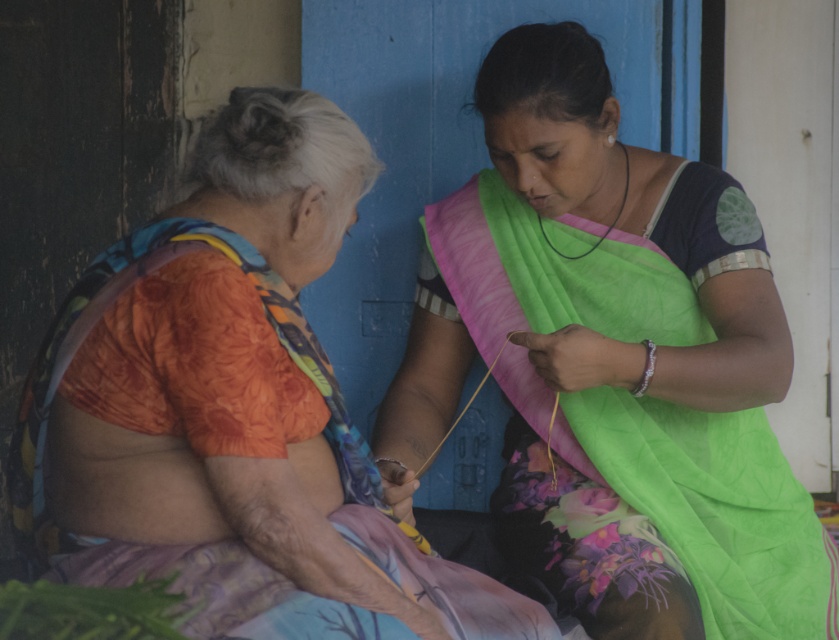
Question: Does green silk saree at center lie in front of orange floral blouse at left?

Choices:
 (A) yes
 (B) no

Answer: (B)

Question: Is green silk saree at center wider than orange floral blouse at left?

Choices:
 (A) no
 (B) yes

Answer: (B)

Question: Which of the following is the closest to the observer?

Choices:
 (A) green silk saree at center
 (B) orange floral blouse at left

Answer: (B)

Question: Which point is closer to the camera?

Choices:
 (A) orange floral blouse at left
 (B) green silk saree at center

Answer: (A)

Question: Is green silk saree at center above orange floral blouse at left?

Choices:
 (A) no
 (B) yes

Answer: (A)